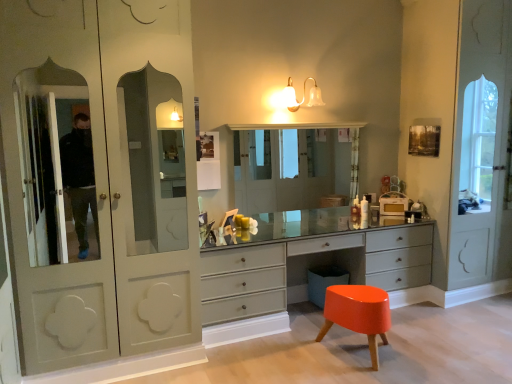
This screenshot has width=512, height=384. What are the coordinates of `vacant location below orange glossy stool at lower right (from a real-world perspective)` in the screenshot? It's located at (364, 362).